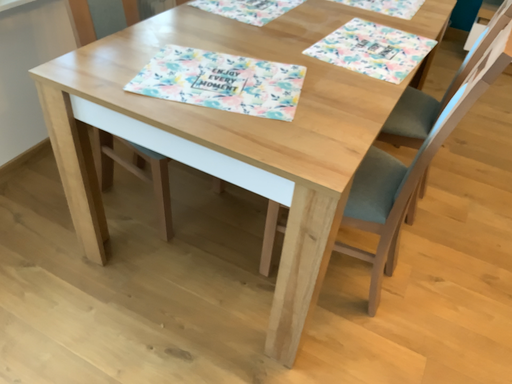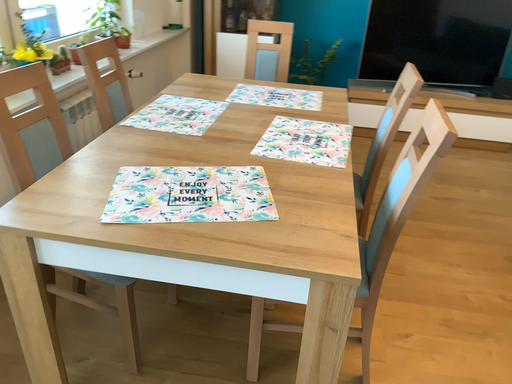
Question: How did the camera likely rotate when shooting the video?

Choices:
 (A) rotated left
 (B) rotated right

Answer: (B)